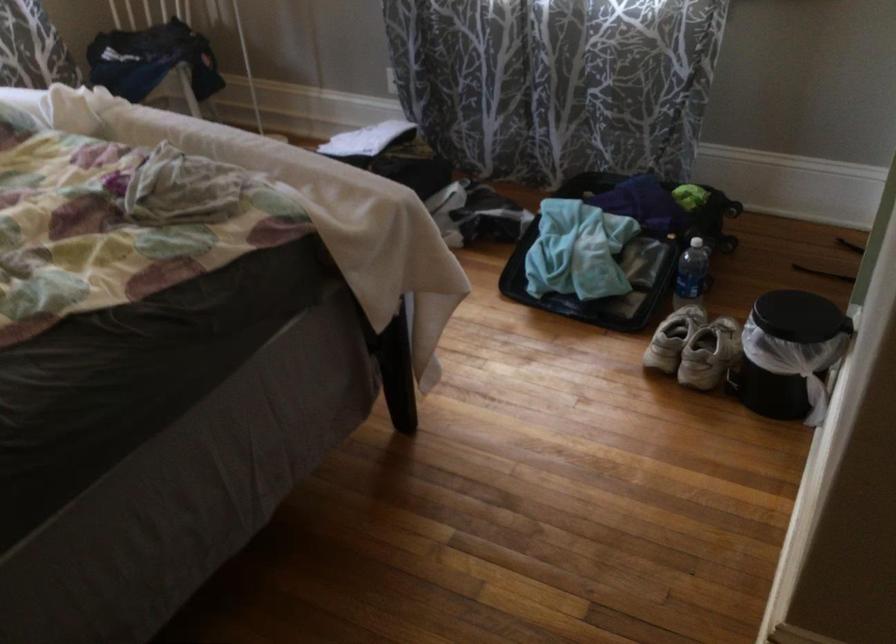
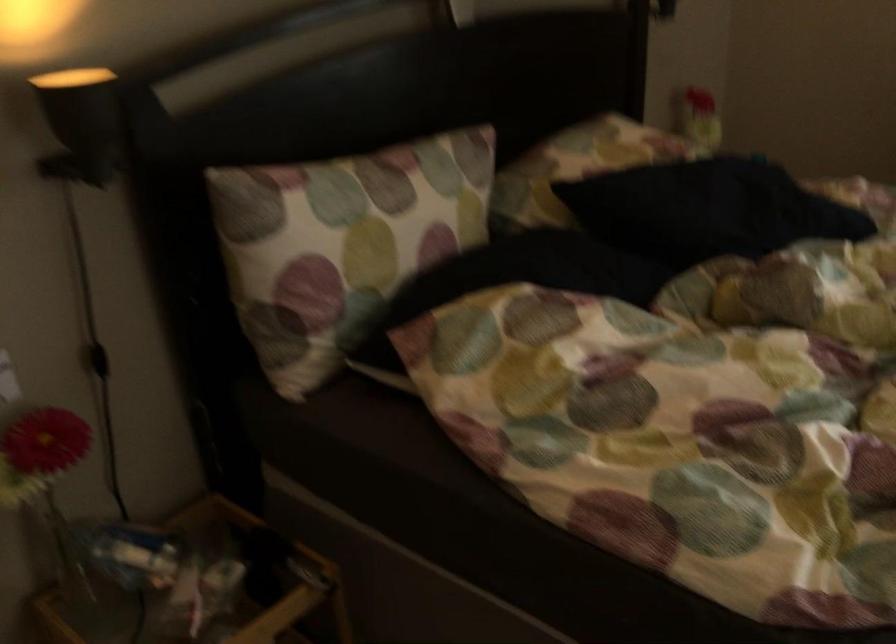
Based on the continuous images, in which direction is the camera rotating?

The camera's rotation is toward left-down.